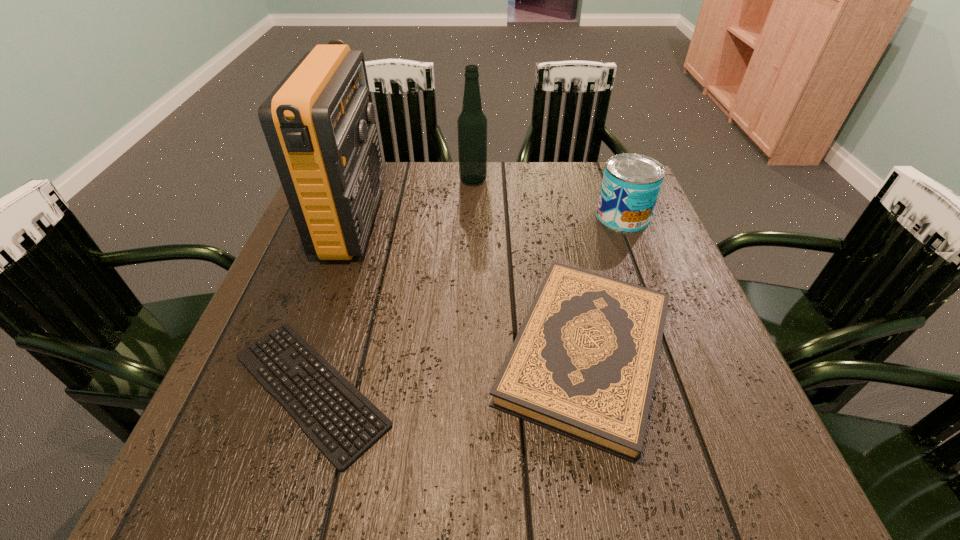
This screenshot has height=540, width=960. I want to click on vacant area between the fourth shortest object and the shortest object, so (x=392, y=285).

This screenshot has height=540, width=960. What are the coordinates of `free space between the third shortest object and the radio receiver` in the screenshot? It's located at (488, 219).

I want to click on vacant space that's between the alcohol and the radio receiver, so click(x=413, y=200).

At what (x,y) coordinates should I click in order to perform the action: click on empty space between the computer keyboard and the can. Please return your answer as a coordinate pair (x, y). Looking at the image, I should click on (467, 303).

I want to click on free space between the tallest object and the computer keyboard, so click(x=331, y=305).

The image size is (960, 540). What are the coordinates of `free space between the can and the shortest object` in the screenshot? It's located at (467, 303).

Identify the location of object that is the second closest to the second tallest object. click(631, 183).

Identify which object is the closest to the alcohol. Please provide its 2D coordinates. Your answer should be formatted as a tuple, i.e. [(x, y)], where the tuple contains the x and y coordinates of a point satisfying the conditions above.

[(318, 122)]

At what (x,y) coordinates should I click in order to perform the action: click on vacant space that satisfies the following two spatial constraints: 1. on the back side of the alcohol; 2. on the left side of the computer keyboard. Please return your answer as a coordinate pair (x, y). This screenshot has width=960, height=540. Looking at the image, I should click on (376, 180).

At what (x,y) coordinates should I click in order to perform the action: click on vacant space that satisfies the following two spatial constraints: 1. on the front side of the third shortest object; 2. on the right side of the alcohol. Please return your answer as a coordinate pair (x, y). This screenshot has width=960, height=540. Looking at the image, I should click on (472, 217).